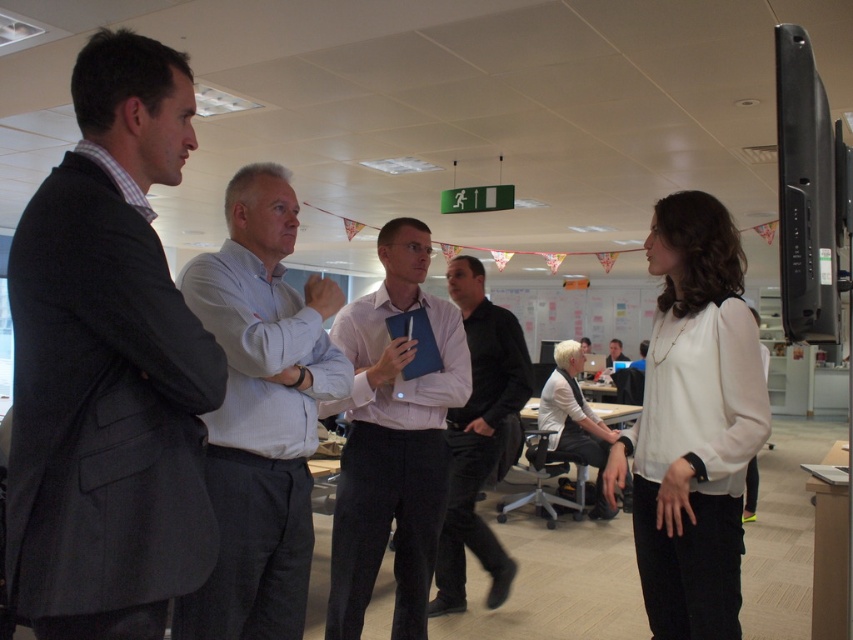
Question: Which object is positioned farthest from the light blue shirt at center?

Choices:
 (A) white matte blouse at center
 (B) white shirt at center

Answer: (B)

Question: Which of the following is the farthest from the observer?

Choices:
 (A) (555, 364)
 (B) (422, 593)
 (C) (485, 394)

Answer: (A)

Question: Estimate the real-world distances between objects in this image. Which object is closer to the white shirt at center?

Choices:
 (A) white matte blouse at center
 (B) light blue shirt at center
 (C) pink fabric shirt at center

Answer: (C)

Question: Can you confirm if white satin blouse at center is positioned below pink fabric shirt at center?

Choices:
 (A) yes
 (B) no

Answer: (B)

Question: Is dark gray suit at left to the right of white matte blouse at center from the viewer's perspective?

Choices:
 (A) yes
 (B) no

Answer: (B)

Question: Can you confirm if light pink shirt at center is thinner than white matte blouse at center?

Choices:
 (A) yes
 (B) no

Answer: (A)